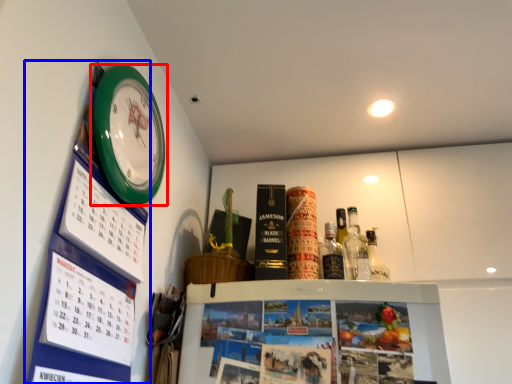
Question: Which point is closer to the camera, wall clock (highlighted by a red box) or bulletin board (highlighted by a blue box)?

Choices:
 (A) wall clock
 (B) bulletin board

Answer: (B)